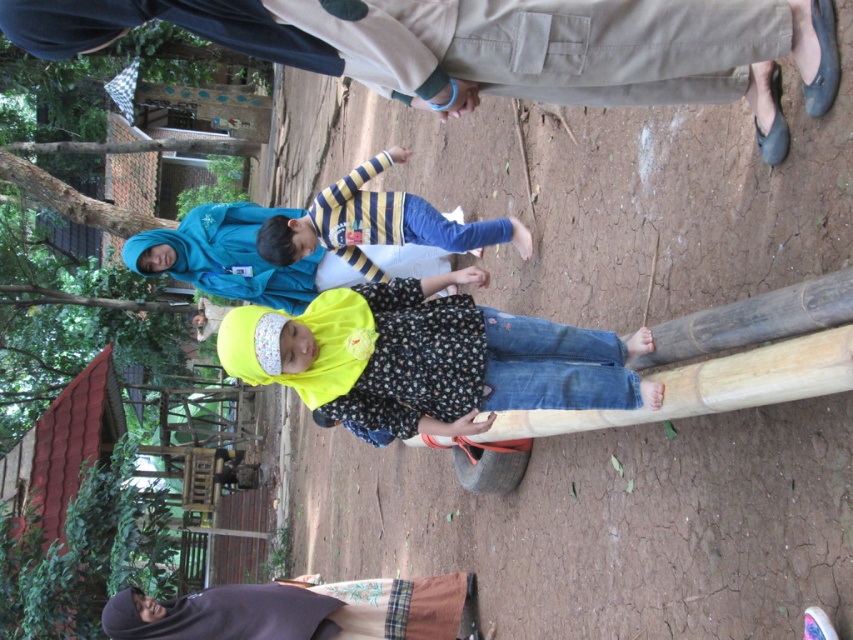
Question: Is floral fabric dress at center smaller than dark purple fabric at lower left?

Choices:
 (A) no
 (B) yes

Answer: (A)

Question: Among these points, which one is farthest from the camera?

Choices:
 (A) (433, 627)
 (B) (287, 218)

Answer: (B)

Question: Can you confirm if floral fabric dress at center is positioned to the right of striped fabric shirt at center?

Choices:
 (A) yes
 (B) no

Answer: (A)

Question: Is floral fabric dress at center wider than dark purple fabric at lower left?

Choices:
 (A) no
 (B) yes

Answer: (A)

Question: Estimate the real-world distances between objects in this image. Which object is farther from the floral fabric dress at center?

Choices:
 (A) striped fabric shirt at center
 (B) dark purple fabric at lower left

Answer: (B)

Question: Which of the following is the farthest from the observer?

Choices:
 (A) (416, 218)
 (B) (392, 417)
 (C) (393, 579)

Answer: (C)